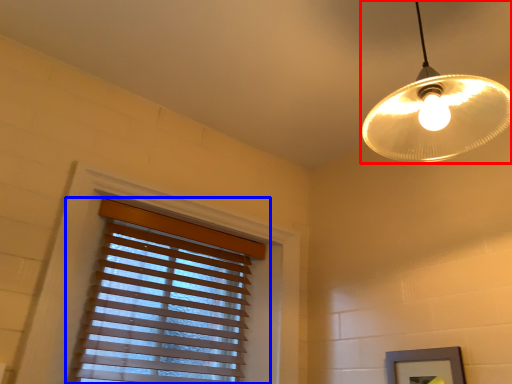
Question: Which point is closer to the camera, lamp (highlighted by a red box) or window blind (highlighted by a blue box)?

Choices:
 (A) lamp
 (B) window blind

Answer: (A)